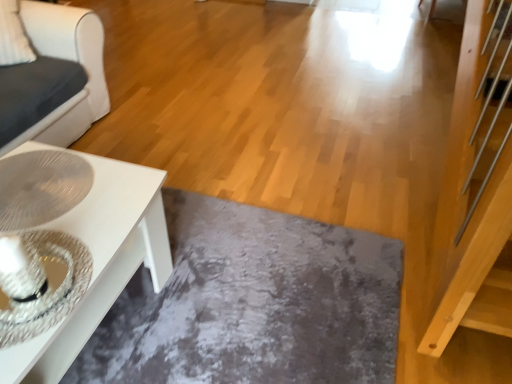
Question: Are white glossy table at lower left and slate at lower center located far from each other?

Choices:
 (A) yes
 (B) no

Answer: (B)

Question: Is white glossy table at lower left at the right side of slate at lower center?

Choices:
 (A) yes
 (B) no

Answer: (B)

Question: From the image's perspective, is white glossy table at lower left located above slate at lower center?

Choices:
 (A) yes
 (B) no

Answer: (A)

Question: Is white glossy table at lower left taller than slate at lower center?

Choices:
 (A) no
 (B) yes

Answer: (B)

Question: Can you confirm if white glossy table at lower left is shorter than slate at lower center?

Choices:
 (A) yes
 (B) no

Answer: (B)

Question: Is white glossy table at lower left to the left of slate at lower center from the viewer's perspective?

Choices:
 (A) yes
 (B) no

Answer: (A)

Question: Is white glossy coffee table at lower left with slate at lower center?

Choices:
 (A) yes
 (B) no

Answer: (B)

Question: Considering the relative sizes of white glossy coffee table at lower left and slate at lower center in the image provided, is white glossy coffee table at lower left taller than slate at lower center?

Choices:
 (A) yes
 (B) no

Answer: (A)

Question: Can you confirm if white glossy coffee table at lower left is positioned to the left of slate at lower center?

Choices:
 (A) no
 (B) yes

Answer: (B)

Question: Is white glossy coffee table at lower left further to camera compared to slate at lower center?

Choices:
 (A) yes
 (B) no

Answer: (A)

Question: Can you confirm if white glossy coffee table at lower left is shorter than slate at lower center?

Choices:
 (A) no
 (B) yes

Answer: (A)

Question: Can you confirm if white glossy coffee table at lower left is bigger than slate at lower center?

Choices:
 (A) no
 (B) yes

Answer: (B)

Question: Is slate at lower center oriented towards white glossy table at lower left?

Choices:
 (A) no
 (B) yes

Answer: (A)